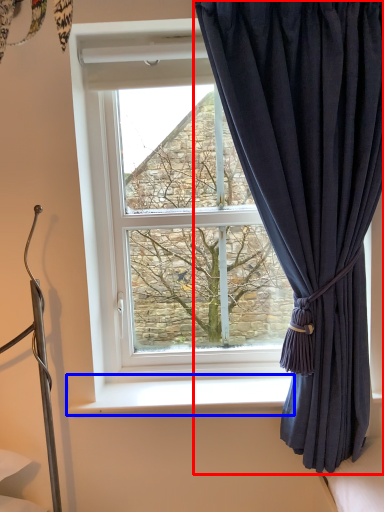
Question: Which point is closer to the camera, curtain (highlighted by a red box) or window sill (highlighted by a blue box)?

Choices:
 (A) curtain
 (B) window sill

Answer: (A)